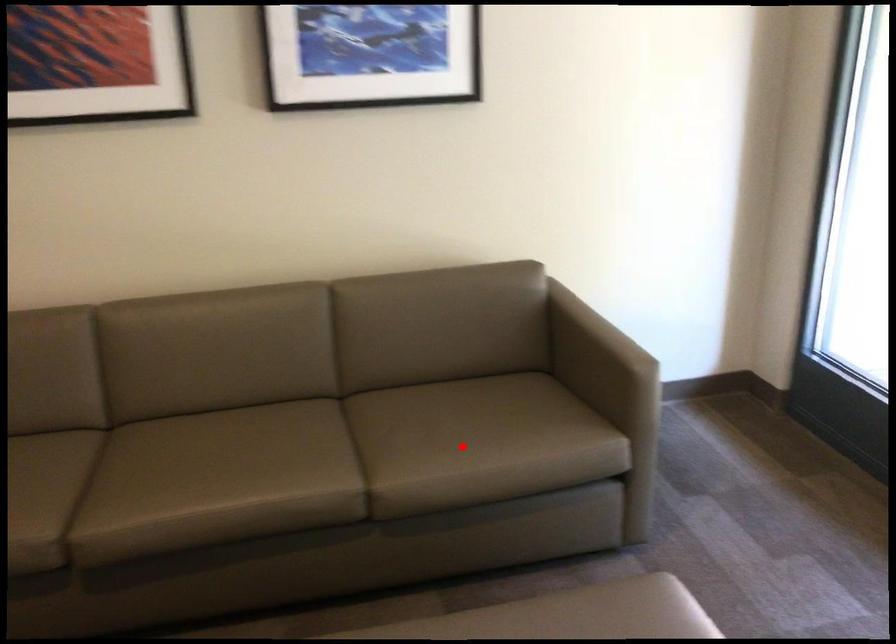
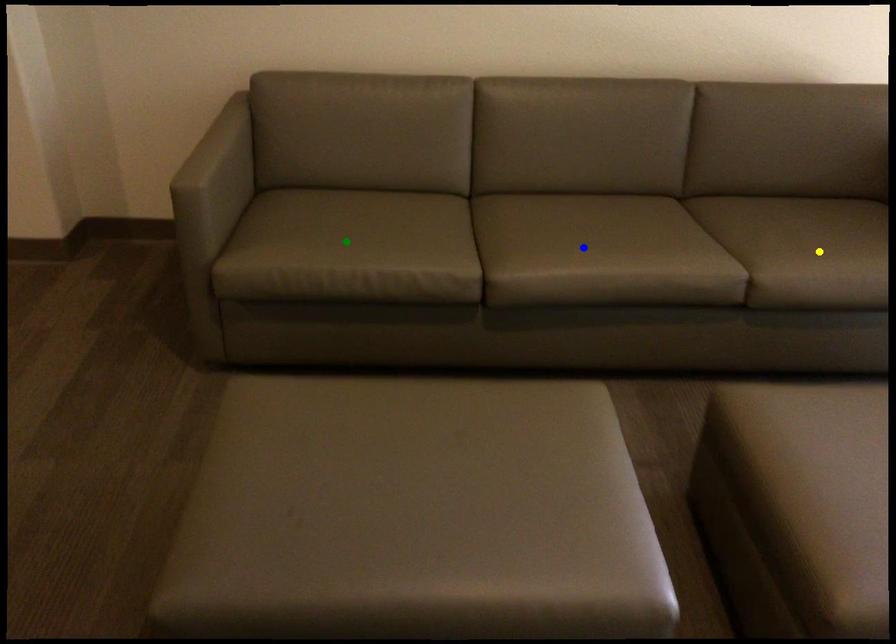
Question: I am providing you with two images of the same scene from different viewpoints. A red point is marked on the first image. You are given multiple points on the second image. Which point in image 2 is actually the same real-world point as the red point in image 1?

Choices:
 (A) green point
 (B) blue point
 (C) yellow point

Answer: (C)